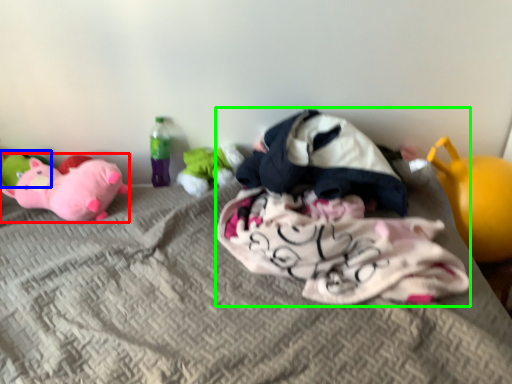
Question: Which is nearer to the toy (highlighted by a red box)? toy (highlighted by a blue box) or laundry (highlighted by a green box).

Choices:
 (A) toy
 (B) laundry

Answer: (A)